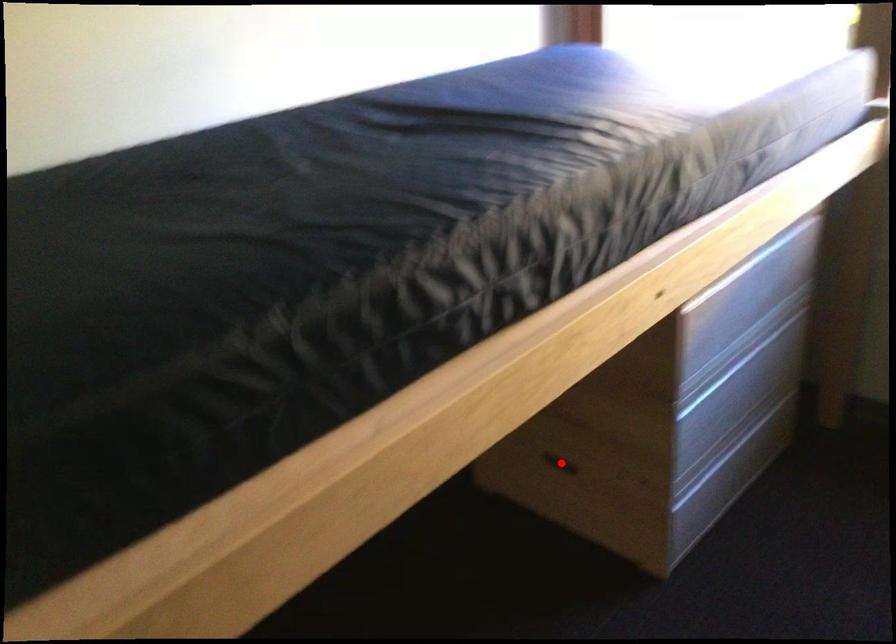
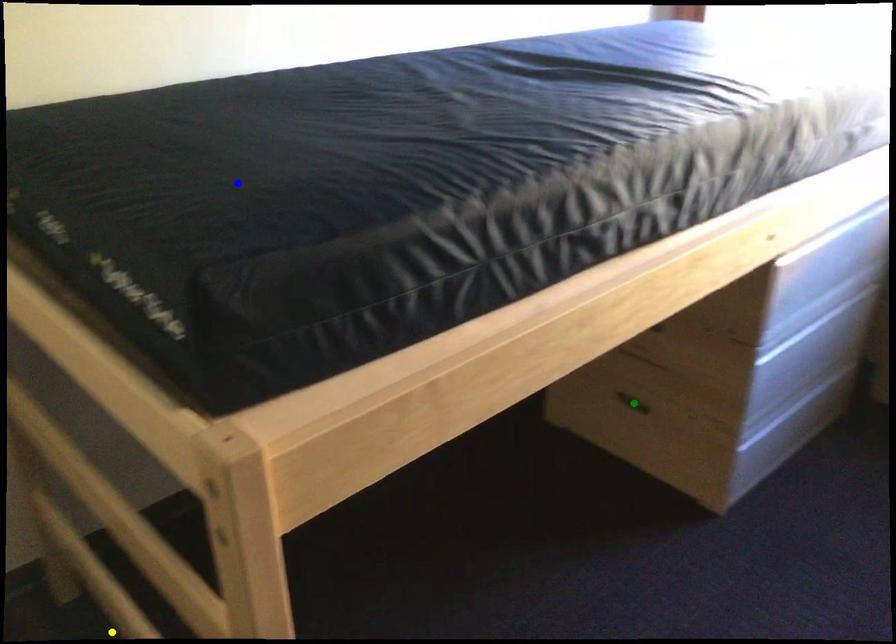
Question: I am providing you with two images of the same scene from different viewpoints. A red point is marked on the first image. You are given multiple points on the second image. Which point in image 2 is actually the same real-world point as the red point in image 1?

Choices:
 (A) yellow point
 (B) green point
 (C) blue point

Answer: (B)